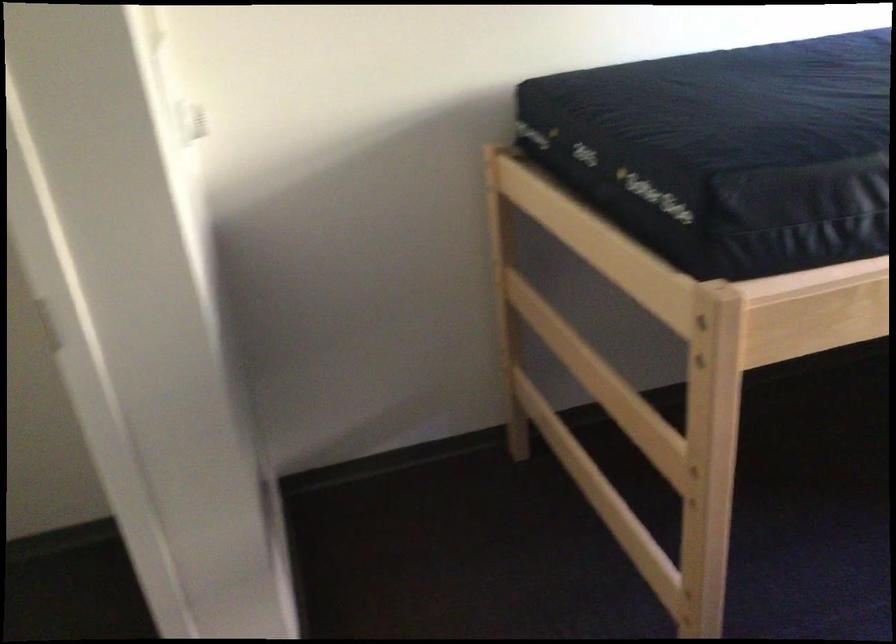
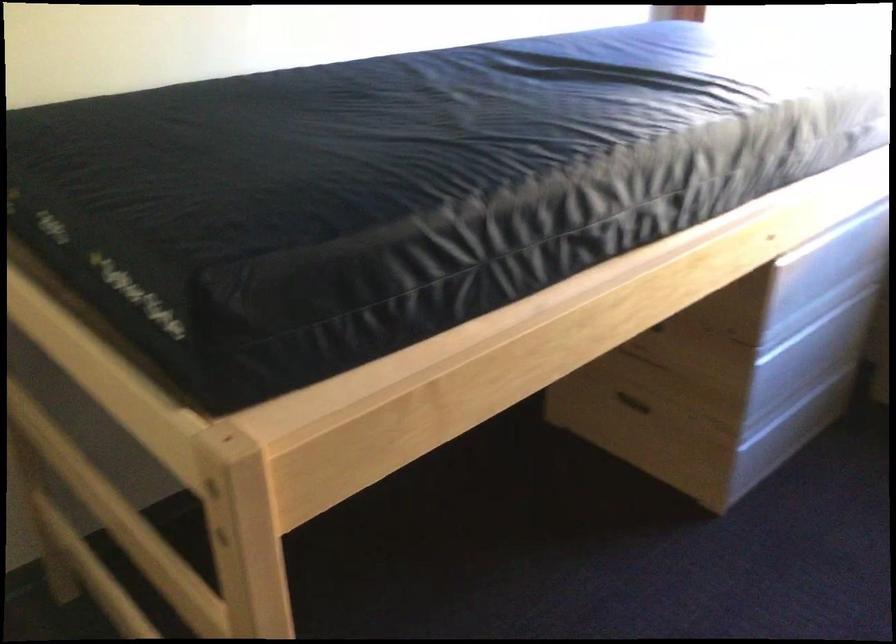
Question: The camera is either moving clockwise (left) or counter-clockwise (right) around the object. The first image is from the beginning of the video and the second image is from the end. Is the camera moving left or right when shooting the video?

Choices:
 (A) Left
 (B) Right

Answer: (A)